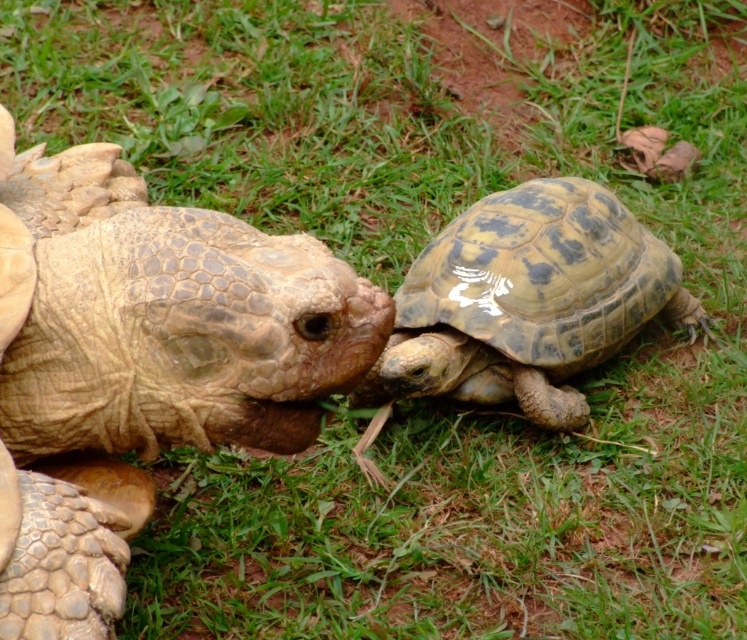
You are a photographer trying to capture the perfect shot of the leathery brown tortoise at center. You want to position your camera exactly at the center point of its location. What are the coordinates where you should aim your camera?

The coordinates you should aim your camera at are exactly the 2D location of the leathery brown tortoise at center, which is at point [142,364].